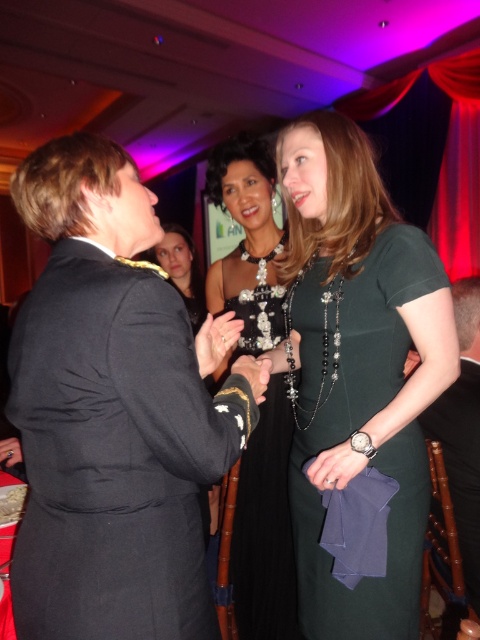
Which is behind, point (466, 520) or point (171, 240)?

Positioned behind is point (171, 240).

I want to click on black fabric dress at center, so click(x=463, y=432).

Which is in front, point (477, 461) or point (192, 266)?

Point (477, 461)

At what (x,y) coordinates should I click in order to perform the action: click on black fabric dress at center. Please return your answer as a coordinate pair (x, y). Image resolution: width=480 pixels, height=640 pixels. Looking at the image, I should click on (463, 432).

Describe the element at coordinates (265, 528) in the screenshot. I see `black satin dress at center` at that location.

Is black satin dress at center positioned in front of dark brown hair at center?

Yes, it is in front of dark brown hair at center.

Which is behind, point (259, 422) or point (191, 284)?

The point (191, 284) is behind.

Locate an element on the screen. The height and width of the screenshot is (640, 480). black satin dress at center is located at coordinates (265, 528).

Is point (325, 627) positioned after point (259, 628)?

That is False.

Who is more distant from viewer, (384, 552) or (283, 285)?

The point (283, 285) is behind.

The height and width of the screenshot is (640, 480). I want to click on dark green dress at center, so click(357, 381).